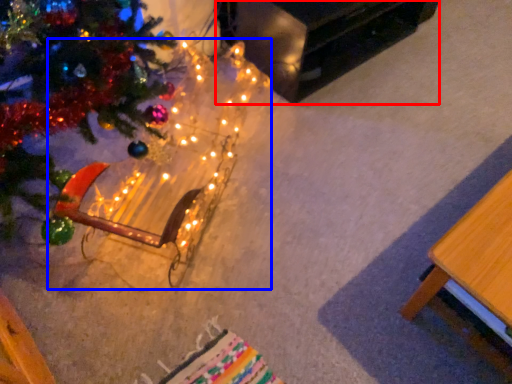
Question: Among these objects, which one is farthest to the camera, table (highlighted by a red box) or christmas decoration (highlighted by a blue box)?

Choices:
 (A) table
 (B) christmas decoration

Answer: (A)